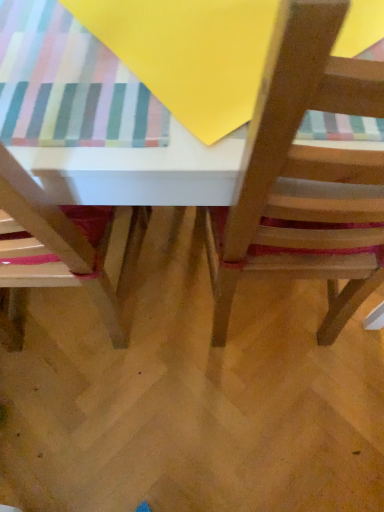
Question: Considering the positions of point (304, 167) and point (283, 109), is point (304, 167) closer or farther from the camera than point (283, 109)?

Choices:
 (A) closer
 (B) farther

Answer: (B)

Question: From a real-world perspective, is wooden chair at center, placed as the second chair when sorted from left to right, positioned above or below wooden table at center?

Choices:
 (A) above
 (B) below

Answer: (A)

Question: Considering the real-world distances, which object is farthest from the wooden chair at center, which is the first chair in right-to-left order?

Choices:
 (A) wooden table at center
 (B) wooden chair at lower left, which appears as the 1th chair when viewed from the left

Answer: (B)

Question: Considering the real-world distances, which object is farthest from the wooden table at center?

Choices:
 (A) wooden chair at lower left, which appears as the 1th chair when viewed from the left
 (B) wooden chair at center, which is the first chair in right-to-left order

Answer: (A)